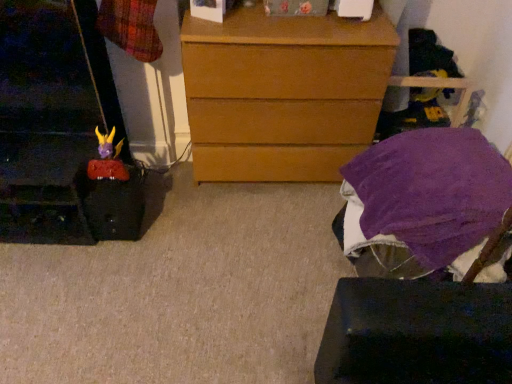
Question: Does purple soft fabric at lower right have a greater height compared to wooden chest of drawers at center?

Choices:
 (A) yes
 (B) no

Answer: (B)

Question: From a real-world perspective, is purple soft fabric at lower right on top of wooden chest of drawers at center?

Choices:
 (A) yes
 (B) no

Answer: (A)

Question: Considering the relative sizes of purple soft fabric at lower right and wooden chest of drawers at center in the image provided, is purple soft fabric at lower right bigger than wooden chest of drawers at center?

Choices:
 (A) no
 (B) yes

Answer: (A)

Question: Would you say purple soft fabric at lower right is outside wooden chest of drawers at center?

Choices:
 (A) yes
 (B) no

Answer: (A)

Question: Is wooden chest of drawers at center inside purple soft fabric at lower right?

Choices:
 (A) no
 (B) yes

Answer: (A)

Question: Is purple soft fabric at lower right not close to wooden chest of drawers at center?

Choices:
 (A) yes
 (B) no

Answer: (B)

Question: From the image's perspective, is matte plastic toy at left located above purple fabric-covered stool at lower right?

Choices:
 (A) no
 (B) yes

Answer: (B)

Question: Would you consider matte plastic toy at left to be distant from purple fabric-covered stool at lower right?

Choices:
 (A) yes
 (B) no

Answer: (A)

Question: From a real-world perspective, does matte plastic toy at left stand above purple fabric-covered stool at lower right?

Choices:
 (A) no
 (B) yes

Answer: (B)

Question: Is matte plastic toy at left surrounding purple fabric-covered stool at lower right?

Choices:
 (A) no
 (B) yes

Answer: (A)

Question: Is matte plastic toy at left aimed at purple fabric-covered stool at lower right?

Choices:
 (A) yes
 (B) no

Answer: (B)

Question: Is matte plastic toy at left smaller than purple fabric-covered stool at lower right?

Choices:
 (A) no
 (B) yes

Answer: (B)

Question: Is purple soft fabric at lower right directly adjacent to matte plastic toy at left?

Choices:
 (A) yes
 (B) no

Answer: (B)